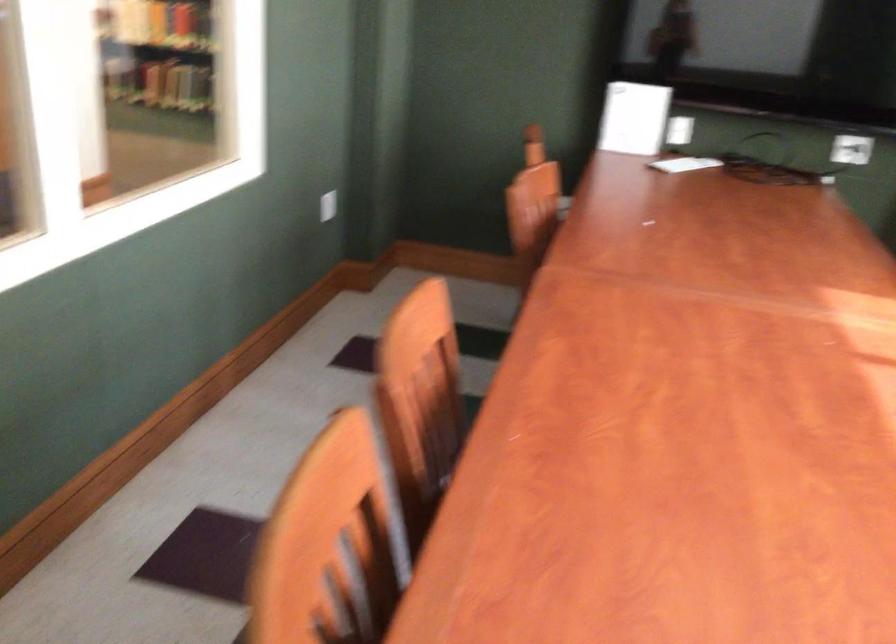
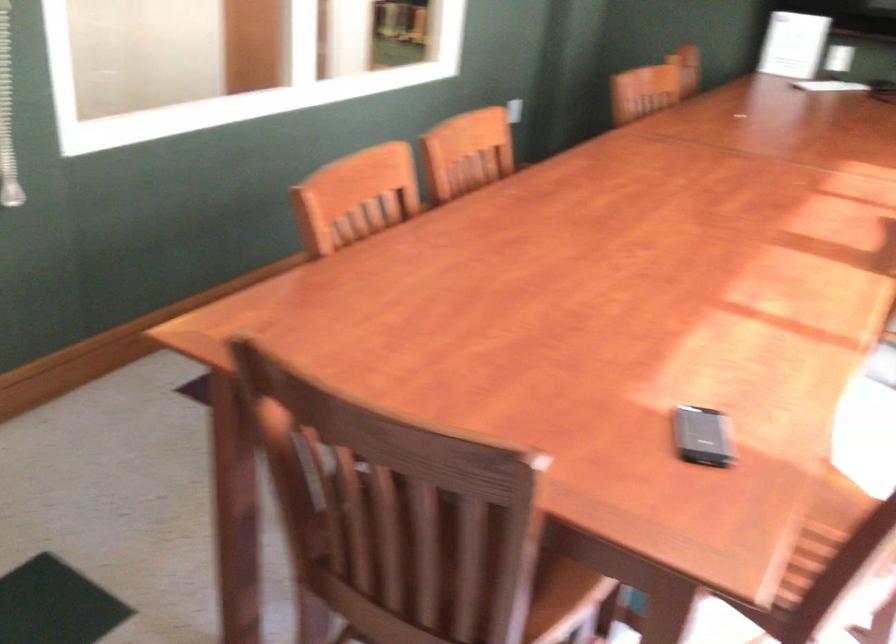
Question: The camera is either moving clockwise (left) or counter-clockwise (right) around the object. The first image is from the beginning of the video and the second image is from the end. Is the camera moving left or right when shooting the video?

Choices:
 (A) Left
 (B) Right

Answer: (B)